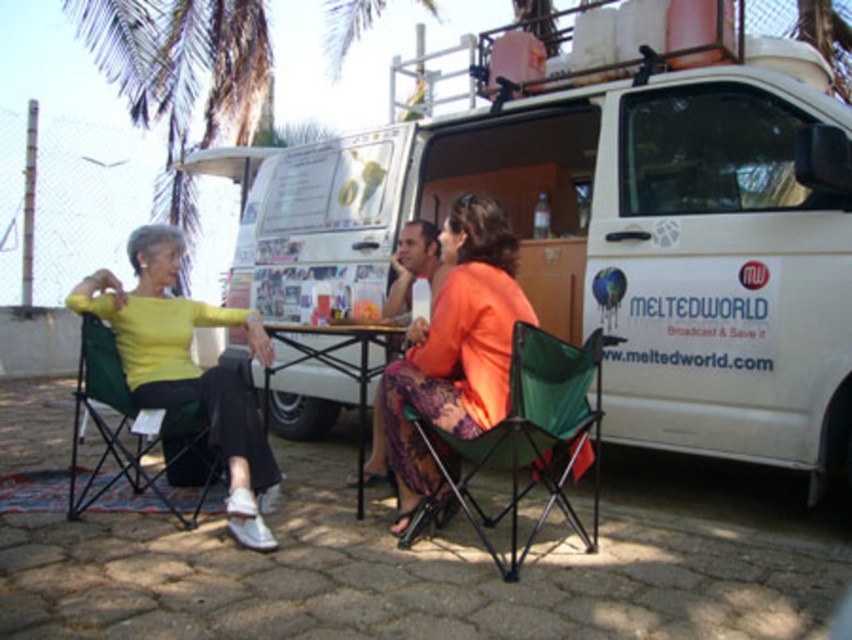
Question: Can you confirm if white matte van at center is bigger than yellow matte sweater at left?

Choices:
 (A) yes
 (B) no

Answer: (A)

Question: Among these points, which one is farthest from the camera?

Choices:
 (A) (576, 442)
 (B) (416, 483)

Answer: (B)

Question: Can you confirm if orange fabric dress at center is positioned to the left of green fabric folding chair at center?

Choices:
 (A) yes
 (B) no

Answer: (A)

Question: Among these objects, which one is farthest from the camera?

Choices:
 (A) wooden table at center
 (B) yellow matte sweater at left

Answer: (A)

Question: Which point is farther to the camera?

Choices:
 (A) 217,323
 (B) 355,458
 (C) 551,488

Answer: (B)

Question: From the image, what is the correct spatial relationship of yellow matte sweater at left in relation to orange fabric dress at center?

Choices:
 (A) right
 (B) left

Answer: (B)